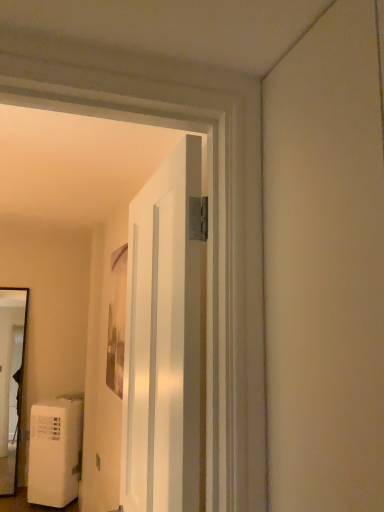
Question: Is white glossy door at center next to matte wooden picture frame at center?

Choices:
 (A) yes
 (B) no

Answer: (B)

Question: Is white glossy door at center thinner than matte wooden picture frame at center?

Choices:
 (A) yes
 (B) no

Answer: (B)

Question: Is white glossy door at center not near matte wooden picture frame at center?

Choices:
 (A) no
 (B) yes

Answer: (B)

Question: Can you confirm if white glossy door at center is taller than matte wooden picture frame at center?

Choices:
 (A) yes
 (B) no

Answer: (A)

Question: Is white glossy door at center outside of matte wooden picture frame at center?

Choices:
 (A) yes
 (B) no

Answer: (A)

Question: In terms of height, does white glossy door at center look taller or shorter compared to matte wooden picture frame at center?

Choices:
 (A) tall
 (B) short

Answer: (A)

Question: From a real-world perspective, is white glossy door at center physically located above or below matte wooden picture frame at center?

Choices:
 (A) below
 (B) above

Answer: (A)

Question: Looking at their shapes, would you say white glossy door at center is wider or thinner than matte wooden picture frame at center?

Choices:
 (A) wide
 (B) thin

Answer: (A)

Question: Considering the relative positions of white glossy door at center and matte wooden picture frame at center in the image provided, is white glossy door at center to the left or to the right of matte wooden picture frame at center?

Choices:
 (A) left
 (B) right

Answer: (B)

Question: From a real-world perspective, relative to white matte water heater at lower left, is white glossy door at center vertically above or below?

Choices:
 (A) below
 (B) above

Answer: (B)

Question: Considering the positions of white glossy door at center and white matte water heater at lower left in the image, is white glossy door at center wider or thinner than white matte water heater at lower left?

Choices:
 (A) thin
 (B) wide

Answer: (A)

Question: From the image's perspective, is white glossy door at center positioned above or below white matte water heater at lower left?

Choices:
 (A) below
 (B) above

Answer: (B)

Question: From their relative heights in the image, would you say white glossy door at center is taller or shorter than white matte water heater at lower left?

Choices:
 (A) tall
 (B) short

Answer: (A)

Question: In the image, is matte wooden picture frame at center on the left side or the right side of white glossy door at center?

Choices:
 (A) right
 (B) left

Answer: (B)

Question: From a real-world perspective, relative to white glossy door at center, is matte wooden picture frame at center vertically above or below?

Choices:
 (A) above
 (B) below

Answer: (A)